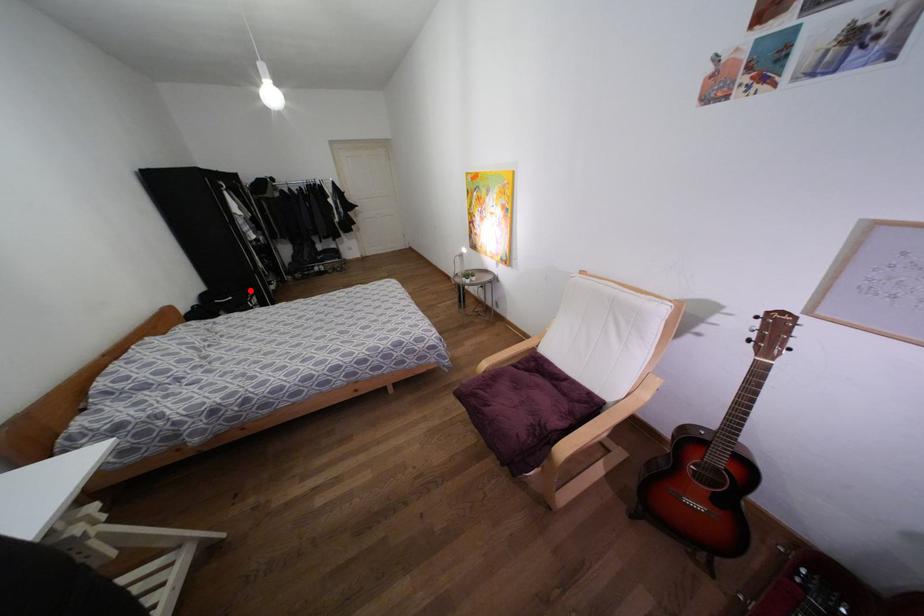
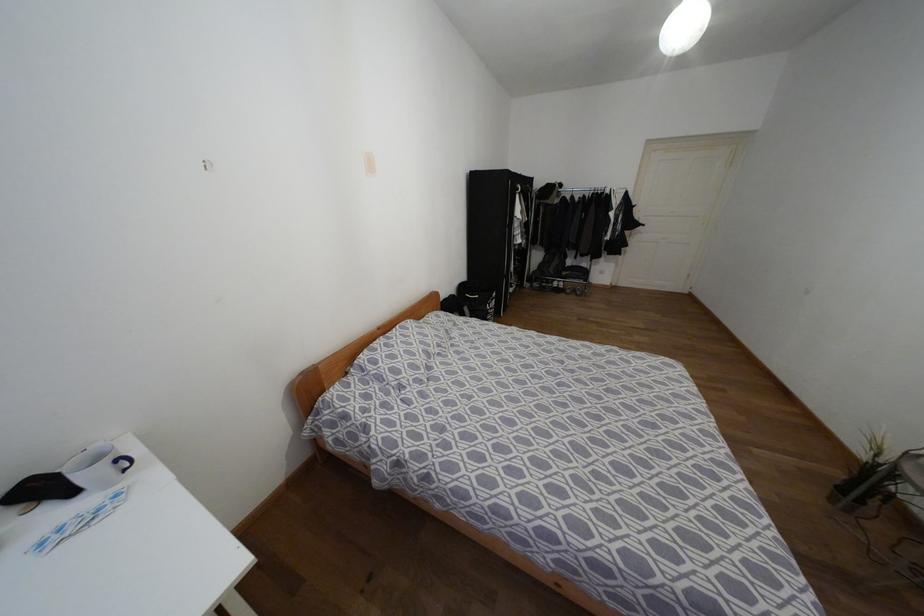
Question: I am providing you with two images of the same scene from different viewpoints. A red point is shown in image1. For the corresponding object point in image2, is it positioned nearer or farther from the camera?

Choices:
 (A) Nearer
 (B) Farther

Answer: (B)